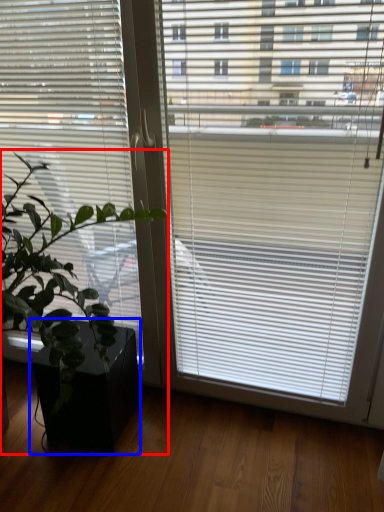
Question: Which object is further to the camera taking this photo, houseplant (highlighted by a red box) or flowerpot (highlighted by a blue box)?

Choices:
 (A) houseplant
 (B) flowerpot

Answer: (B)